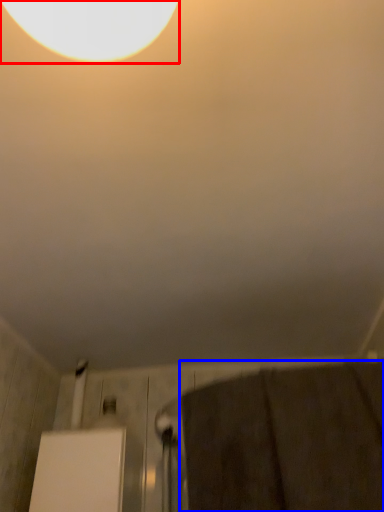
Question: Which of the following is the closest to the observer, lamp (highlighted by a red box) or bath towel (highlighted by a blue box)?

Choices:
 (A) lamp
 (B) bath towel

Answer: (A)